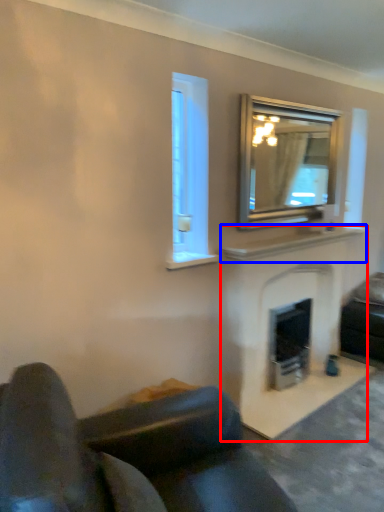
Question: Which object appears closest to the camera in this image, fireplace (highlighted by a red box) or mantle (highlighted by a blue box)?

Choices:
 (A) fireplace
 (B) mantle

Answer: (A)